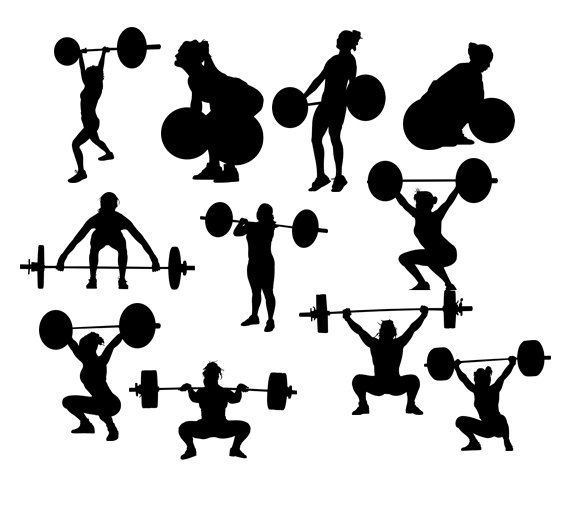
At what (x,y) coordinates should I click in order to perform the action: click on bar. Please return your answer as a coordinate pair (x, y). This screenshot has height=514, width=570. Looking at the image, I should click on (74, 266), (91, 326), (173, 387), (377, 309), (474, 359), (431, 179), (282, 225), (109, 47), (312, 104).